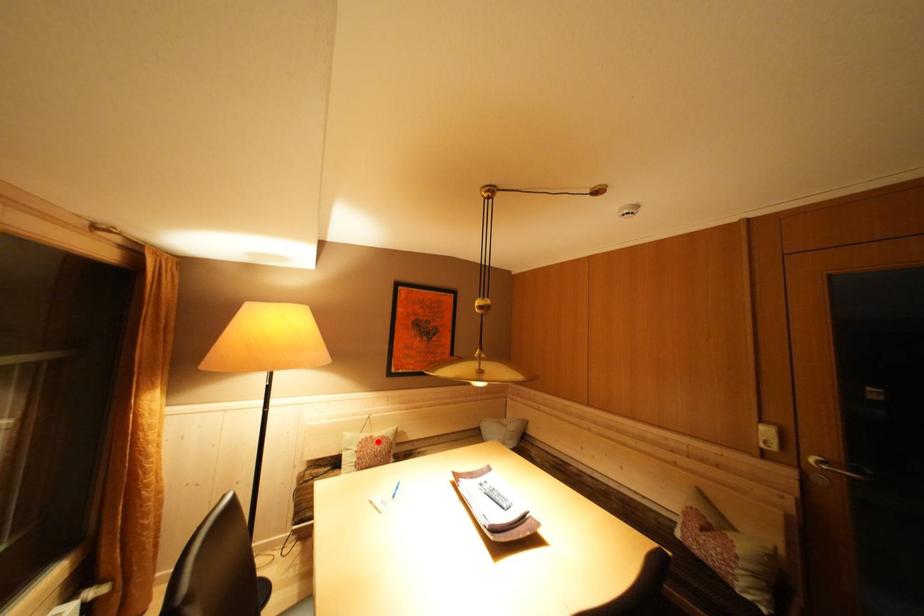
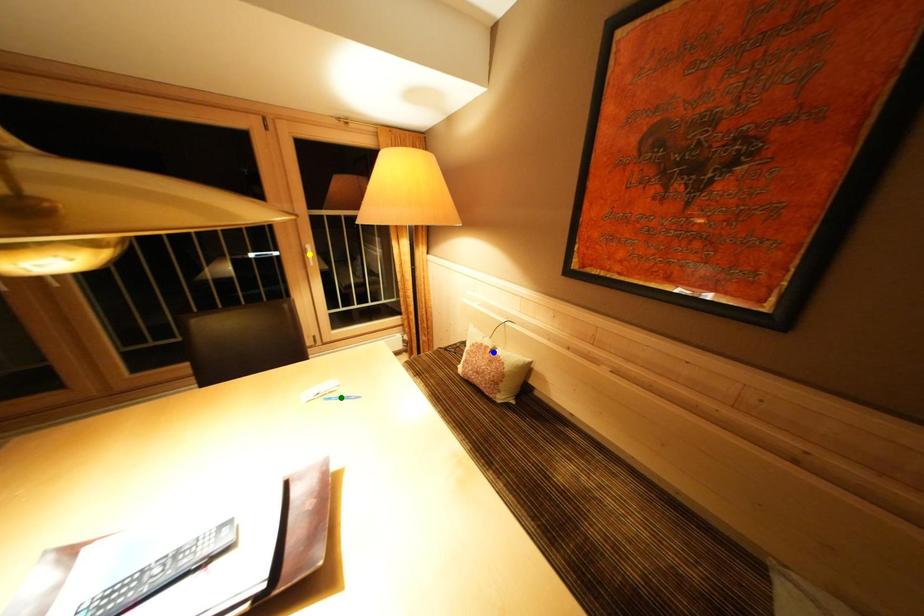
Question: I am providing you with two images of the same scene from different viewpoints. A red point is marked on the first image. You are given multiple points on the second image. Can you choose the point in image 2 that corresponds to the point in image 1?

Choices:
 (A) yellow point
 (B) green point
 (C) blue point

Answer: (C)